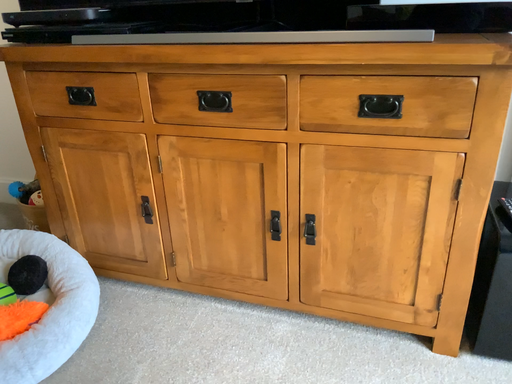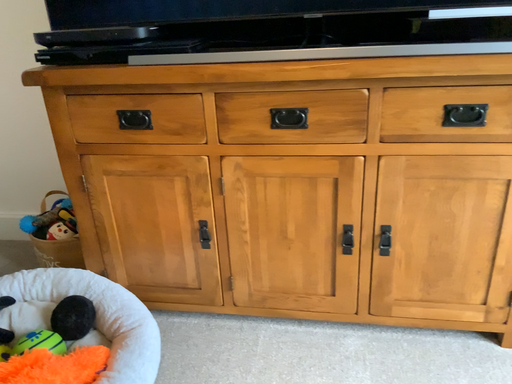
Question: How did the camera likely rotate when shooting the video?

Choices:
 (A) rotated right
 (B) rotated left

Answer: (A)